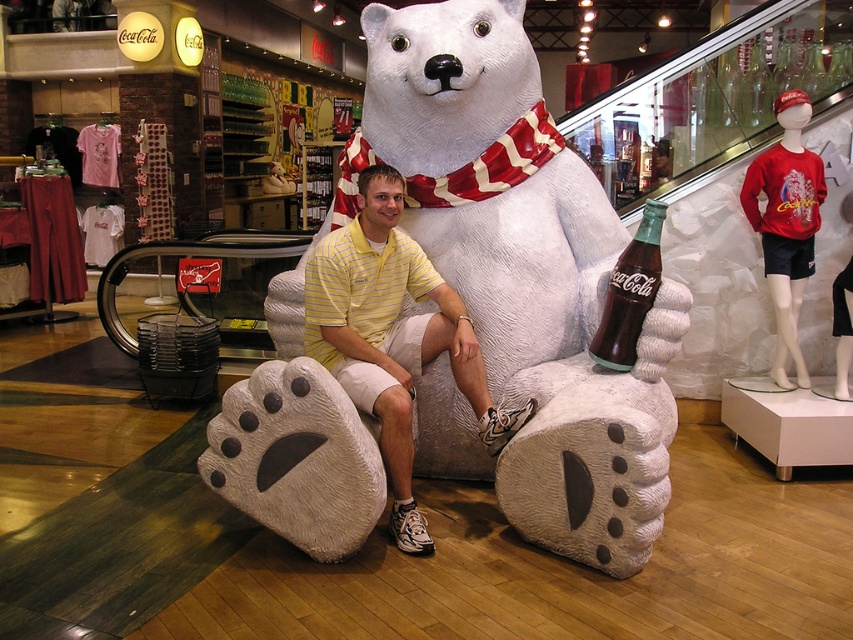
You are a photographer standing in front of the Coca Cola themed store. You notice a man wearing a yellow striped shirt at center and a dark brown glass bottle at center. Which object is located to the left when viewed from your perspective?

The yellow striped shirt at center is positioned on the left side of dark brown glass bottle at center, so the yellow striped shirt at center is located to the left.

You are a customer in the store and want to take a photo of the dark brown glass bottle at center without the white plush bear at center blocking the view. Is it possible to do so by moving closer to the bottle?

The white plush bear at center is closer to the viewer than the dark brown glass bottle at center, so moving closer to the bottle would bring you closer to the bear as well. Therefore, the white plush bear at center would still block the view of the dark brown glass bottle at center.

You are standing in the Coca Cola themed store and want to take a photo of both the polar bear statue and the man sitting in front of it. The statue is at point [325,342] and the man is at point [653,228]. Which one should you focus on first to ensure both are in focus?

Point [325,342] is closer to the camera than point [653,228], so you should focus on the statue first to ensure both are in focus.